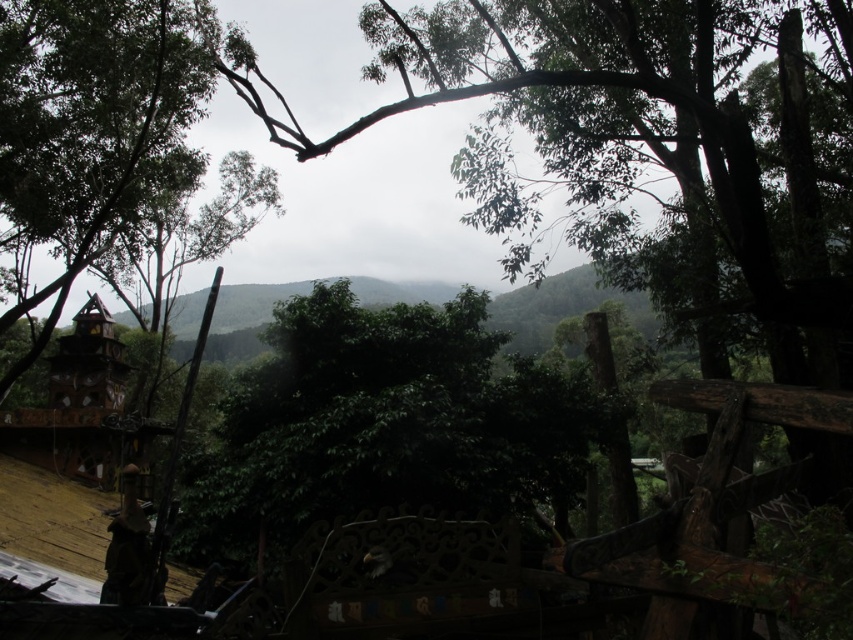
In the scene shown: Which is more to the left, green leafy tree at center or green matte tree at left?

Positioned to the left is green matte tree at left.

Can you confirm if green leafy tree at center is taller than green matte tree at left?

Incorrect, green leafy tree at center's height is not larger of green matte tree at left's.

Does point (238, 390) come behind point (24, 160)?

No, (238, 390) is in front of (24, 160).

You are a GUI agent. You are given a task and a screenshot of the screen. Output one action in this format:
    pyautogui.click(x=<x>, y=<y>)
    Task: Click on the green leafy tree at center
    The image size is (853, 640).
    Given the screenshot: What is the action you would take?
    point(383,426)